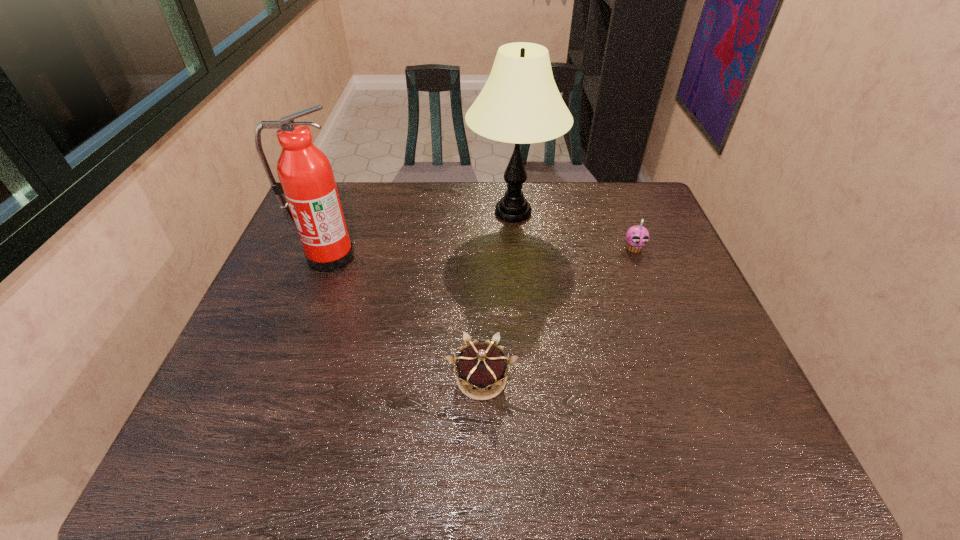
The image size is (960, 540). I want to click on object that is at the right edge, so click(637, 237).

The image size is (960, 540). I want to click on vacant space at the far edge of the desktop, so click(x=446, y=218).

The height and width of the screenshot is (540, 960). I want to click on blank area at the near edge, so (x=424, y=440).

The width and height of the screenshot is (960, 540). I want to click on vacant region at the left edge of the desktop, so click(262, 334).

The height and width of the screenshot is (540, 960). I want to click on vacant region at the right edge, so click(x=651, y=251).

Locate an element on the screen. The width and height of the screenshot is (960, 540). free region at the near left corner is located at coordinates (263, 452).

This screenshot has width=960, height=540. I want to click on vacant space at the far right corner, so [x=621, y=212].

At what (x,y) coordinates should I click in order to perform the action: click on free point between the leftmost object and the lamp. Please return your answer as a coordinate pair (x, y). This screenshot has height=540, width=960. Looking at the image, I should click on (420, 234).

Locate an element on the screen. This screenshot has height=540, width=960. free space between the lamp and the cupcake is located at coordinates (573, 230).

Image resolution: width=960 pixels, height=540 pixels. I want to click on free spot between the leftmost object and the cupcake, so click(481, 252).